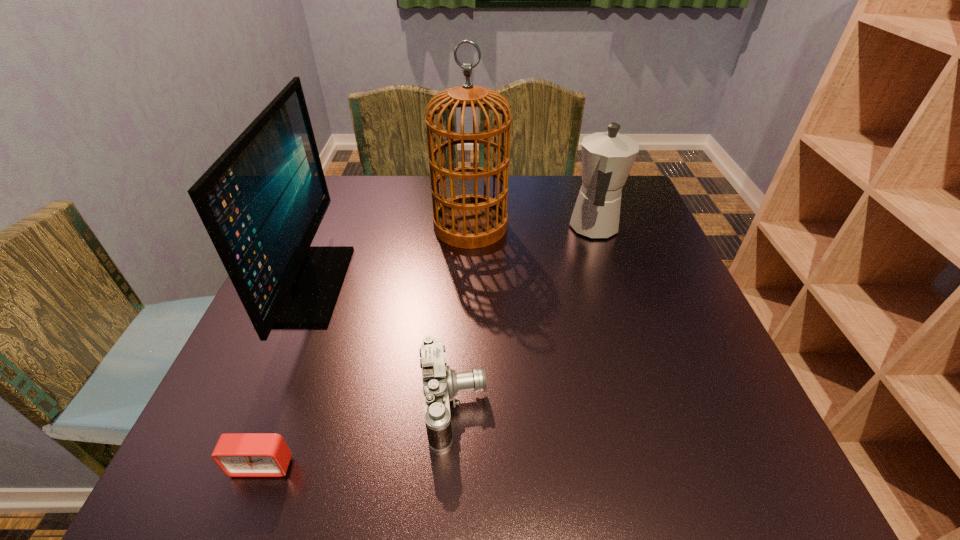
You are a GUI agent. You are given a task and a screenshot of the screen. Output one action in this format:
    pyautogui.click(x=<x>, y=<y>)
    Task: Click on the birdcage
    Image resolution: width=960 pixels, height=540 pixels.
    Given the screenshot: What is the action you would take?
    pyautogui.click(x=467, y=221)

Identify the location of the second tallest object. (262, 201).

At what (x,y) coordinates should I click in order to perform the action: click on coffeepot. Please return your answer as a coordinate pair (x, y). The width and height of the screenshot is (960, 540). Looking at the image, I should click on (607, 157).

Identify the location of the third shortest object. This screenshot has width=960, height=540. (607, 157).

Locate an element on the screen. The width and height of the screenshot is (960, 540). camera is located at coordinates (441, 384).

What are the coordinates of `alarm clock` in the screenshot? It's located at (237, 454).

Where is `vacant area situated on the left of the birdcage`? Image resolution: width=960 pixels, height=540 pixels. vacant area situated on the left of the birdcage is located at coordinates coord(322,226).

Identify the location of vacant point located on the screen side of the second tallest object. (495, 285).

Locate an element on the screen. The image size is (960, 540). free space located 0.210m on the front of the third tallest object is located at coordinates (624, 318).

Where is `vacant space located at the lens of the camera`? vacant space located at the lens of the camera is located at coordinates (591, 404).